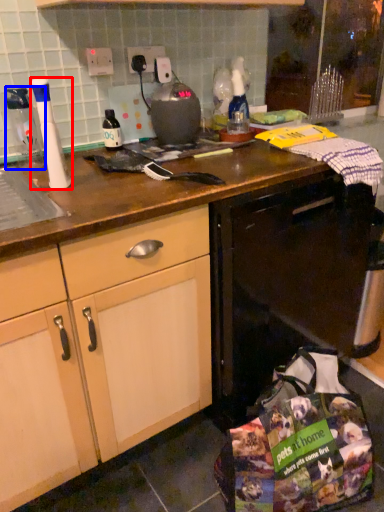
Question: Which point is further to the camera, kitchen appliance (highlighted by a red box) or bottle (highlighted by a blue box)?

Choices:
 (A) kitchen appliance
 (B) bottle

Answer: (B)